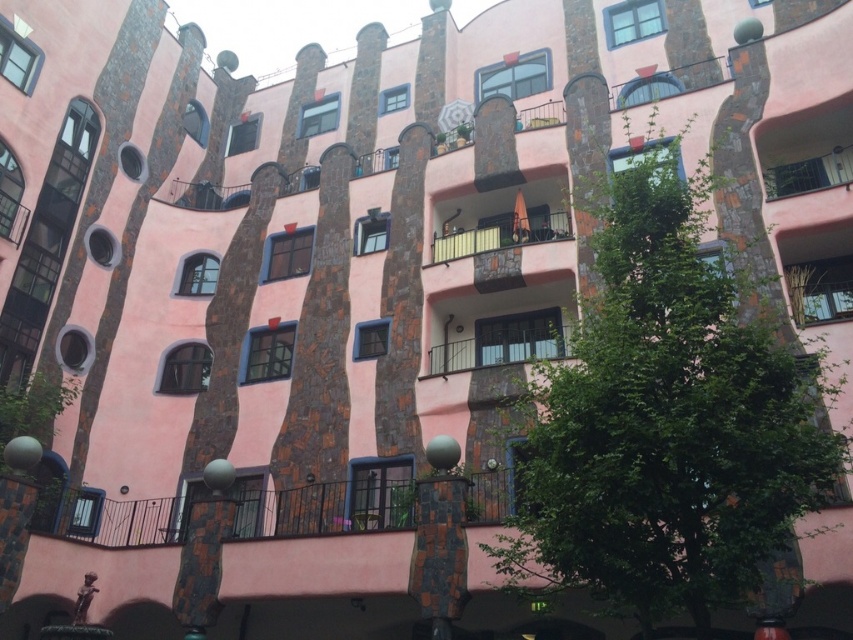
You are standing in front of the building and notice two points on its facade. One is at coordinate point (479, 348) and the other at point (561, 230). Which of these points is closer to you?

Point (479, 348) is further to the viewer than point (561, 230), so the point at (561, 230) is closer to you.

You are standing on the pink stone balcony at center and want to move to the black metal railing at center. In which direction should you move to reach it?

The black metal railing at center is to the left of the pink stone balcony at center, so you should move to the left to reach it.

You are an architect analyzing the building facade. You notice two points marked on the facade at coordinates point (560, 493) and point (556, 349). Which of these two points is positioned closer to the viewer?

Point (560, 493) is closer to the viewer than point (556, 349).